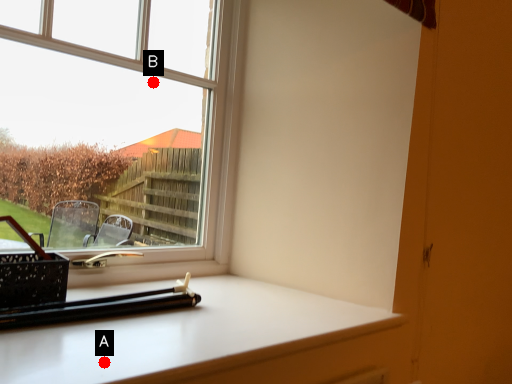
Question: Two points are circled on the image, labeled by A and B beside each circle. Which point is farther from the camera taking this photo?

Choices:
 (A) A is further
 (B) B is further

Answer: (B)